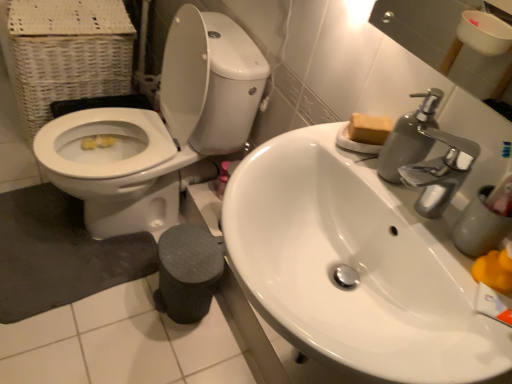
Question: Should I look upward or downward to see white glossy toilet at left?

Choices:
 (A) up
 (B) down

Answer: (A)

Question: Is the position of white glossy sink at upper right less distant than that of brown matte soap at upper right?

Choices:
 (A) yes
 (B) no

Answer: (A)

Question: Is white glossy sink at upper right not within brown matte soap at upper right?

Choices:
 (A) yes
 (B) no

Answer: (A)

Question: From a real-world perspective, does white glossy sink at upper right sit lower than brown matte soap at upper right?

Choices:
 (A) no
 (B) yes

Answer: (B)

Question: Does white glossy sink at upper right lie behind brown matte soap at upper right?

Choices:
 (A) yes
 (B) no

Answer: (B)

Question: Would you say white glossy sink at upper right contains brown matte soap at upper right?

Choices:
 (A) no
 (B) yes

Answer: (A)

Question: Does white glossy sink at upper right have a greater height compared to brown matte soap at upper right?

Choices:
 (A) yes
 (B) no

Answer: (A)

Question: Is dark gray textured bath mat at lower left not within white glossy toilet at left?

Choices:
 (A) no
 (B) yes

Answer: (A)

Question: Considering the relative sizes of dark gray textured bath mat at lower left and white glossy toilet at left in the image provided, is dark gray textured bath mat at lower left thinner than white glossy toilet at left?

Choices:
 (A) yes
 (B) no

Answer: (A)

Question: Considering the relative positions of dark gray textured bath mat at lower left and white glossy toilet at left in the image provided, is dark gray textured bath mat at lower left behind white glossy toilet at left?

Choices:
 (A) yes
 (B) no

Answer: (A)

Question: Is dark gray textured bath mat at lower left next to white glossy toilet at left and touching it?

Choices:
 (A) no
 (B) yes

Answer: (A)

Question: From the image's perspective, is dark gray textured bath mat at lower left on white glossy toilet at left?

Choices:
 (A) yes
 (B) no

Answer: (B)

Question: Considering the relative positions of dark gray textured bath mat at lower left and white glossy toilet at left in the image provided, is dark gray textured bath mat at lower left to the left of white glossy toilet at left from the viewer's perspective?

Choices:
 (A) no
 (B) yes

Answer: (B)

Question: Does white wicker basket at left turn towards metallic gray soap dispenser at upper right?

Choices:
 (A) yes
 (B) no

Answer: (B)